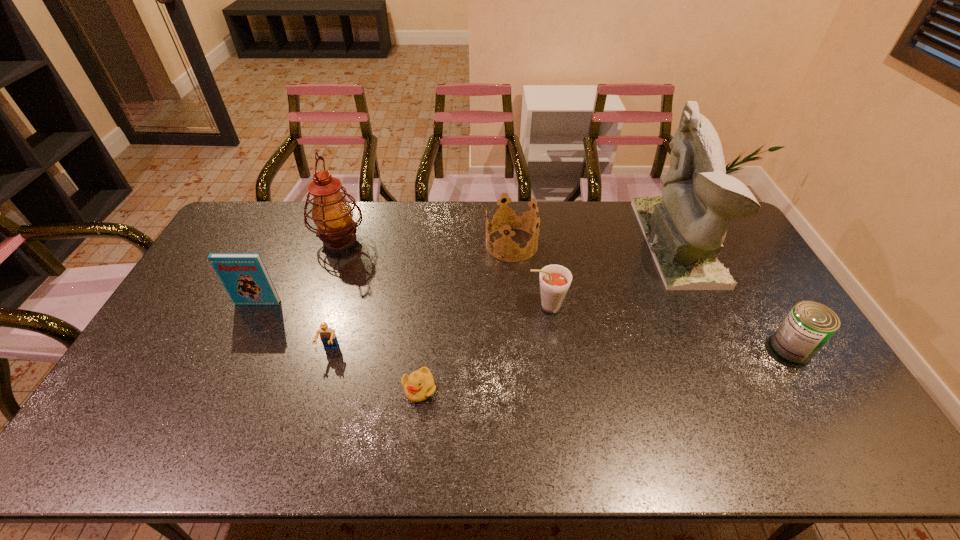
I want to click on free space between the second shortest object and the oil lamp, so click(335, 295).

The image size is (960, 540). I want to click on free space between the book and the rightmost object, so click(524, 326).

The image size is (960, 540). What are the coordinates of `vacant area that lies between the leftmost object and the root beer` in the screenshot? It's located at (402, 305).

Identify which object is the second nearest to the crown. Please provide its 2D coordinates. Your answer should be formatted as a tuple, i.e. [(x, y)], where the tuple contains the x and y coordinates of a point satisfying the conditions above.

[(685, 227)]

You are a GUI agent. You are given a task and a screenshot of the screen. Output one action in this format:
    pyautogui.click(x=<x>, y=<y>)
    Task: Click on the object that stands as the sixth closest to the nearest object
    This screenshot has height=540, width=960.
    Given the screenshot: What is the action you would take?
    pyautogui.click(x=685, y=227)

Identify the location of vacant position in the image that satisfies the following two spatial constraints: 1. on the base of the rightmost object; 2. on the right side of the tallest object. Image resolution: width=960 pixels, height=540 pixels. (729, 348).

This screenshot has width=960, height=540. I want to click on free location that satisfies the following two spatial constraints: 1. on the drink side of the root beer; 2. on the face of the Lego, so click(x=552, y=350).

At what (x,y) coordinates should I click in order to perform the action: click on free space that satisfies the following two spatial constraints: 1. on the base of the second object from right to left; 2. on the front cover of the book. Please return your answer as a coordinate pair (x, y). The image size is (960, 540). Looking at the image, I should click on (707, 303).